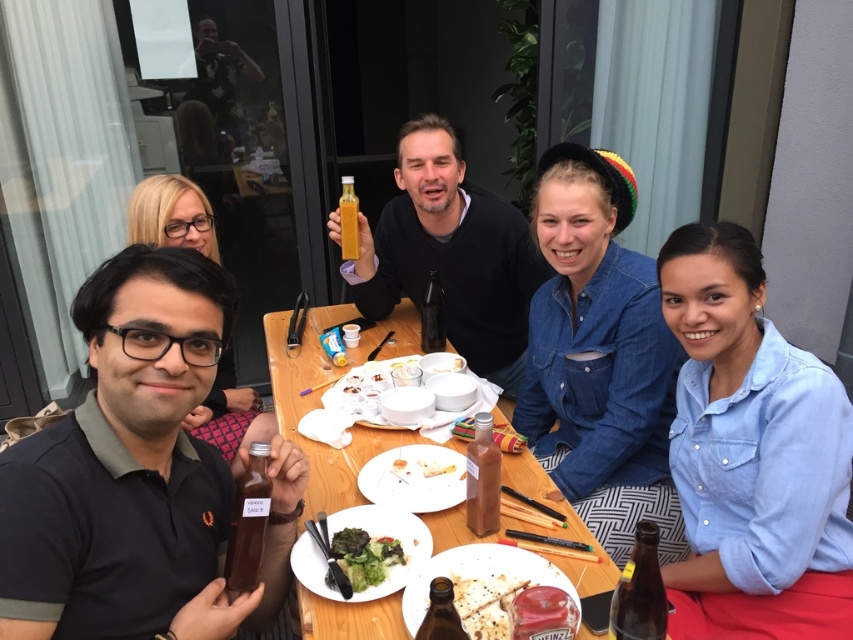
Looking at the table with the green leafy salad at center and the clear glass bottle at center, which item is positioned to the right of the other?

The clear glass bottle at center is to the right of the green leafy salad at center because the salad is to the left of the bottle.

You are sitting at the wooden table outdoors and want to place a new item between the two points labeled point (242, 540) and point (451, 468). According to the scene description, which point should the item be closer to in order to be placed in front of the other?

The item should be placed closer to point (451, 468) because point (242, 540) is in front of point (451, 468). Therefore, placing the item near point (451, 468) would position it behind point (242, 540), fulfilling the requirement of being between them with the specified front relationship.